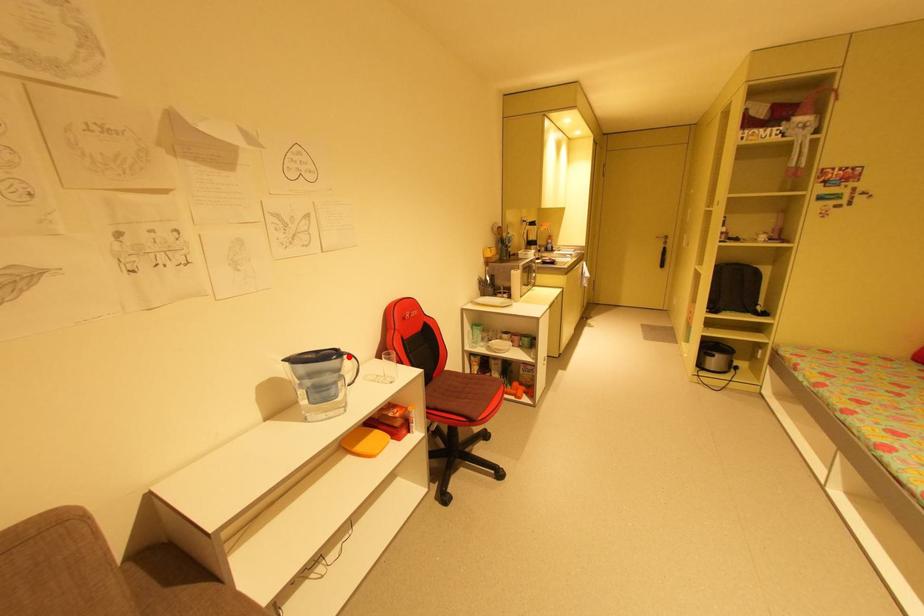
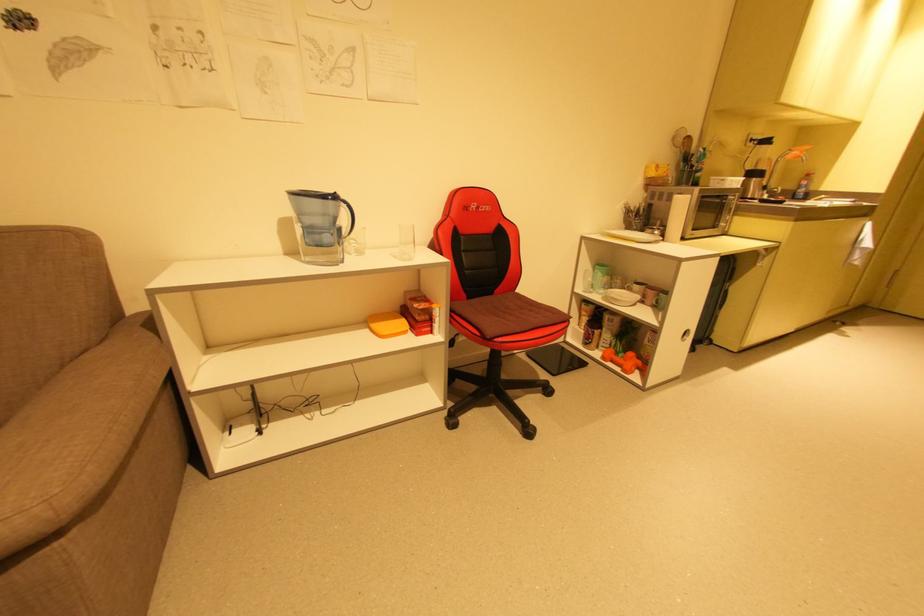
Find the pixel in the second image that matches the highlighted location in the first image.

(346, 204)